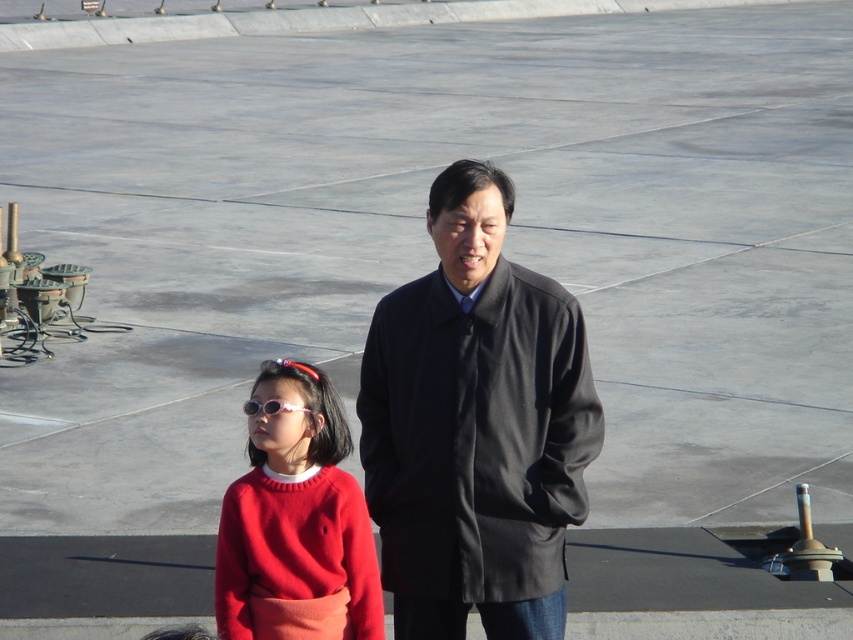
From the picture: You are standing at the origin point of this scene. Where is the dark gray woolen coat at center located in relation to you?

The dark gray woolen coat at center is located at point 0.667 on the x axis and 0.559 on the y axis relative to the origin point.

You are a fashion designer observing the scene. You need to determine which item, the matte red sweater at center or the pink shiny sunglasses at center, is positioned higher up in the image. Based on the spatial arrangement, which one is taller?

The matte red sweater at center is much taller as pink shiny sunglasses at center, so the matte red sweater at center is positioned higher up in the image.

You are an airport security officer inspecting the scene. You notice two items of clothing at the center of the image. The dark gray woolen coat and the matte red sweater. According to the airport security guidelines, items must be placed on separate trays. Can you confirm if the dark gray woolen coat at center is positioned above the matte red sweater at center, requiring them to be placed in different trays?

The dark gray woolen coat at center is above the matte red sweater at center, so they must be placed in different trays as per security guidelines.